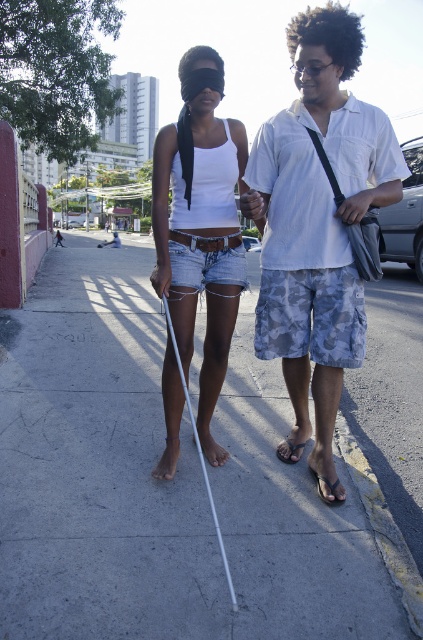
Does gray concrete sidewalk at center have a smaller size compared to black leather sandal at lower center?

No.

Which is below, gray concrete sidewalk at center or black leather sandal at lower center?

black leather sandal at lower center is below.

Identify the location of gray concrete sidewalk at center. The image size is (423, 640). (159, 483).

Who is shorter, white matte blindfold at center or brown leather sandal at lower center?

brown leather sandal at lower center is shorter.

Is white matte blindfold at center to the right of brown leather sandal at lower center from the viewer's perspective?

In fact, white matte blindfold at center is to the left of brown leather sandal at lower center.

Which is behind, point (208, 104) or point (301, 445)?

Positioned behind is point (301, 445).

I want to click on white matte blindfold at center, so (x=200, y=225).

Who is more forward, (283, 198) or (153, 269)?

Point (283, 198) is in front.

Does white cotton shirt at center appear on the right side of white matte blindfold at center?

Indeed, white cotton shirt at center is positioned on the right side of white matte blindfold at center.

Locate an element on the screen. The image size is (423, 640). white cotton shirt at center is located at coordinates (318, 220).